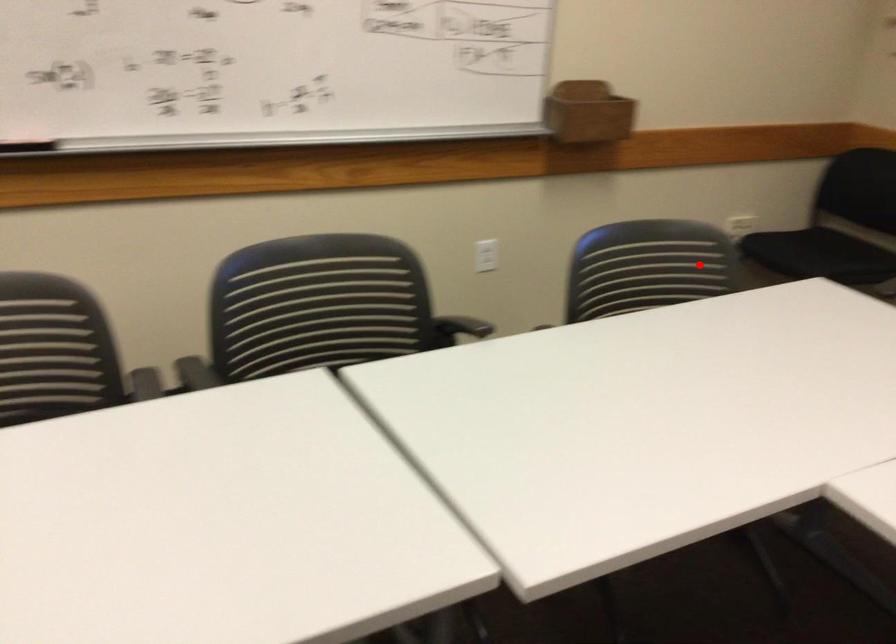
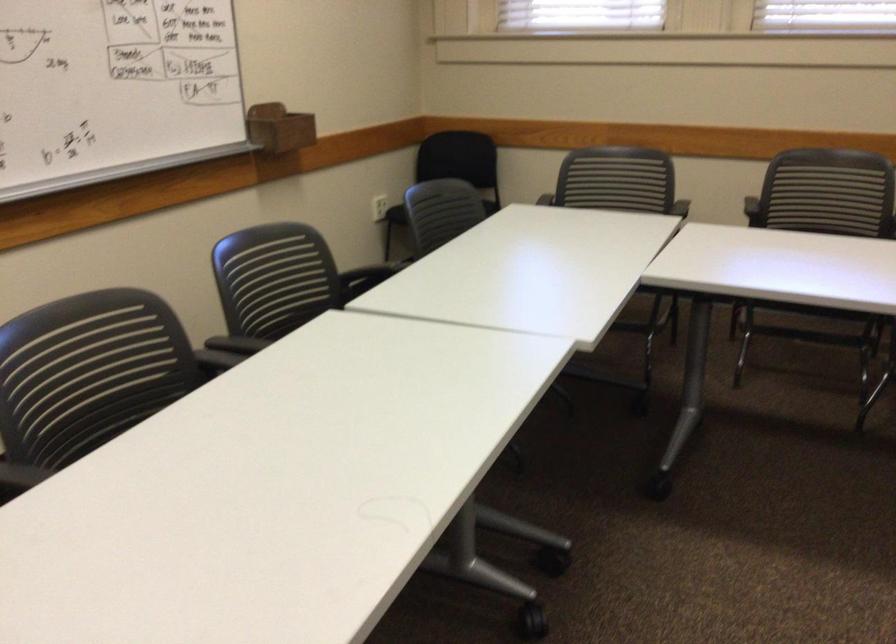
Find the pixel in the second image that matches the highlighted location in the first image.

(441, 212)